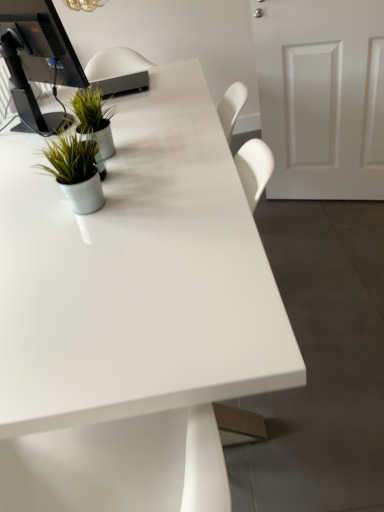
Where is `free space to the left of green matte plant at upper left, which is the 2th houseplant in bottom-to-top order`? The image size is (384, 512). free space to the left of green matte plant at upper left, which is the 2th houseplant in bottom-to-top order is located at coordinates (32, 168).